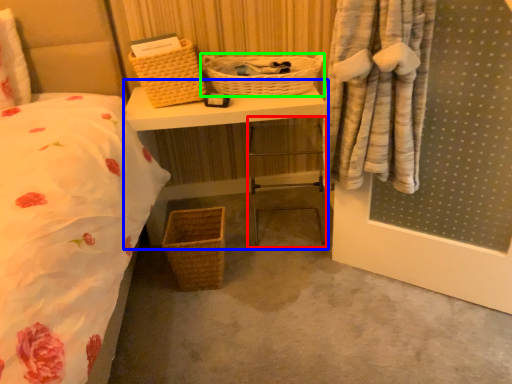
Question: Considering the real-world distances, which object is closest to chair (highlighted by a red box)? vanity (highlighted by a blue box) or picnic basket (highlighted by a green box).

Choices:
 (A) vanity
 (B) picnic basket

Answer: (B)